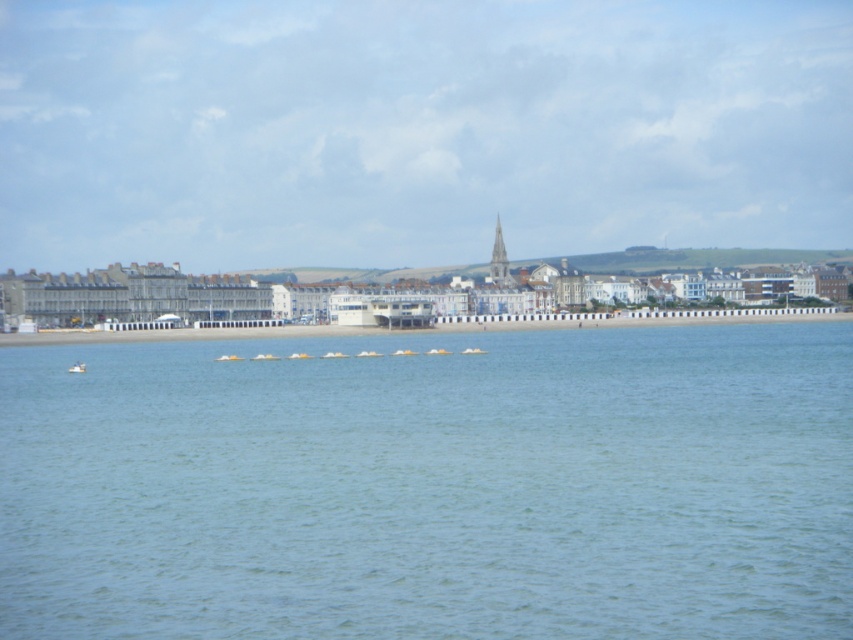
Who is positioned more to the right, smooth white spire at center or white plastic boat at lower left?

smooth white spire at center is more to the right.

Who is higher up, smooth white spire at center or white plastic boat at lower left?

smooth white spire at center

Is point (506, 260) positioned after point (80, 371)?

Yes, point (506, 260) is behind point (80, 371).

At what (x,y) coordinates should I click in order to perform the action: click on smooth white spire at center. Please return your answer as a coordinate pair (x, y). Looking at the image, I should click on (498, 260).

Is point (97, 339) positioned before point (77, 368)?

That is False.

Can you confirm if white sand at center is wider than white plastic boat at lower left?

Indeed, white sand at center has a greater width compared to white plastic boat at lower left.

Where is `white sand at center`? This screenshot has height=640, width=853. white sand at center is located at coordinates (631, 321).

Is clear blue water at center to the left of white plastic boat at lower left from the viewer's perspective?

Incorrect, clear blue water at center is not on the left side of white plastic boat at lower left.

Is clear blue water at center to the right of white plastic boat at lower left from the viewer's perspective?

Yes, clear blue water at center is to the right of white plastic boat at lower left.

Between point (735, 472) and point (68, 369), which one is positioned behind?

The point (68, 369) is behind.

The image size is (853, 640). Find the location of `clear blue water at center`. clear blue water at center is located at coordinates (432, 486).